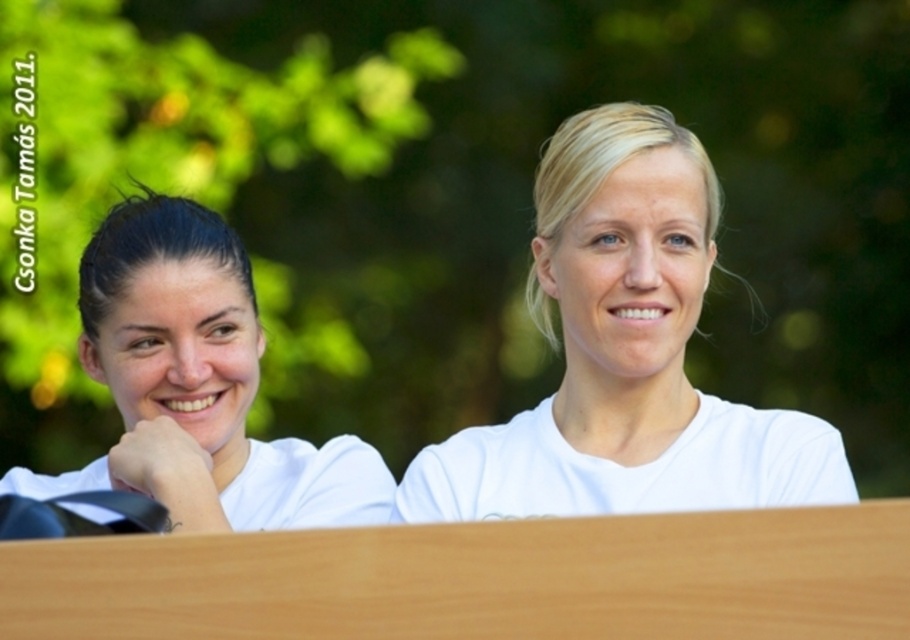
Question: Which point is farther to the camera?

Choices:
 (A) (163, 275)
 (B) (641, 144)

Answer: (A)

Question: Is white matte shirt at center further to camera compared to white matte shirt at left?

Choices:
 (A) yes
 (B) no

Answer: (B)

Question: Which point appears farthest from the camera in this image?

Choices:
 (A) (130, 481)
 (B) (442, 499)

Answer: (B)

Question: Which of the following is the farthest from the observer?

Choices:
 (A) white matte shirt at center
 (B) white matte shirt at left

Answer: (B)

Question: Can you confirm if white matte shirt at center is bigger than white matte shirt at left?

Choices:
 (A) yes
 (B) no

Answer: (A)

Question: Does white matte shirt at center appear on the right side of white matte shirt at left?

Choices:
 (A) yes
 (B) no

Answer: (A)